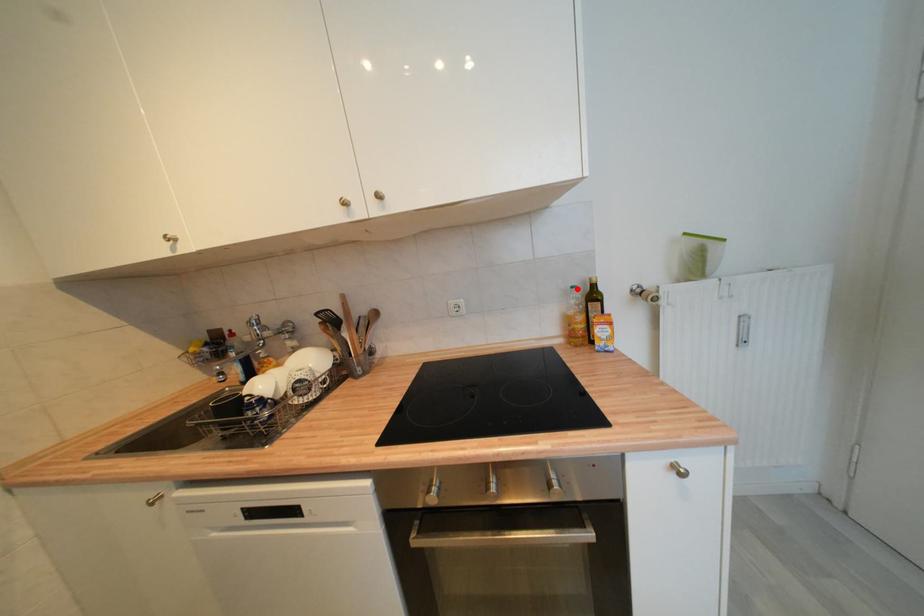
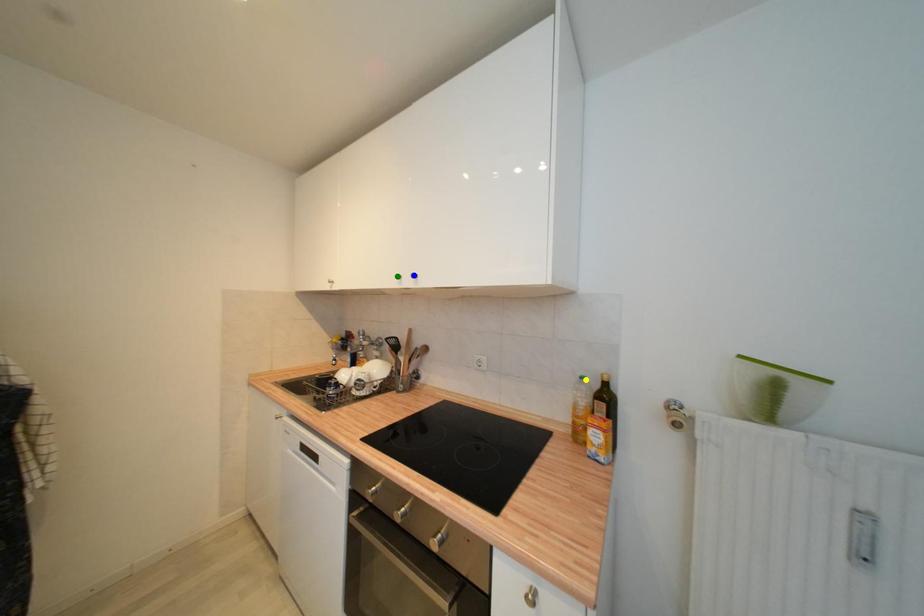
Question: I am providing you with two images of the same scene from different viewpoints. A red point is marked on the first image. You are given multiple points on the second image. In image 2, which mark is for the same physical point as the one in image 1?

Choices:
 (A) green point
 (B) yellow point
 (C) blue point

Answer: (B)